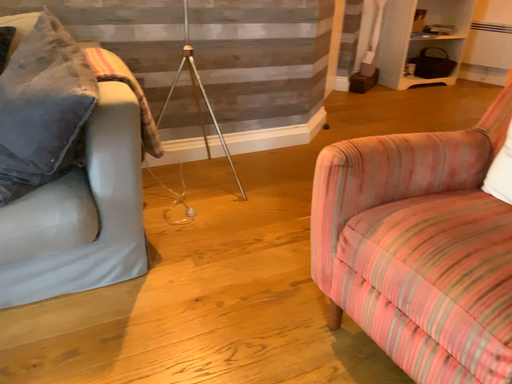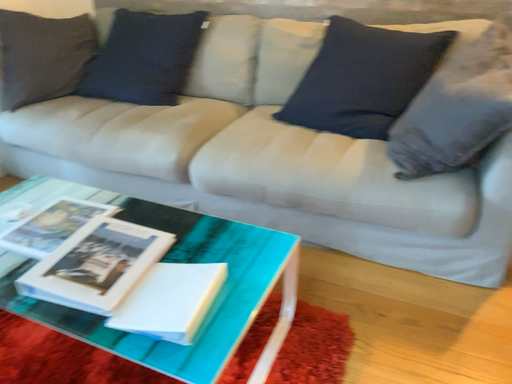
Question: How did the camera likely rotate when shooting the video?

Choices:
 (A) rotated right
 (B) rotated left

Answer: (B)